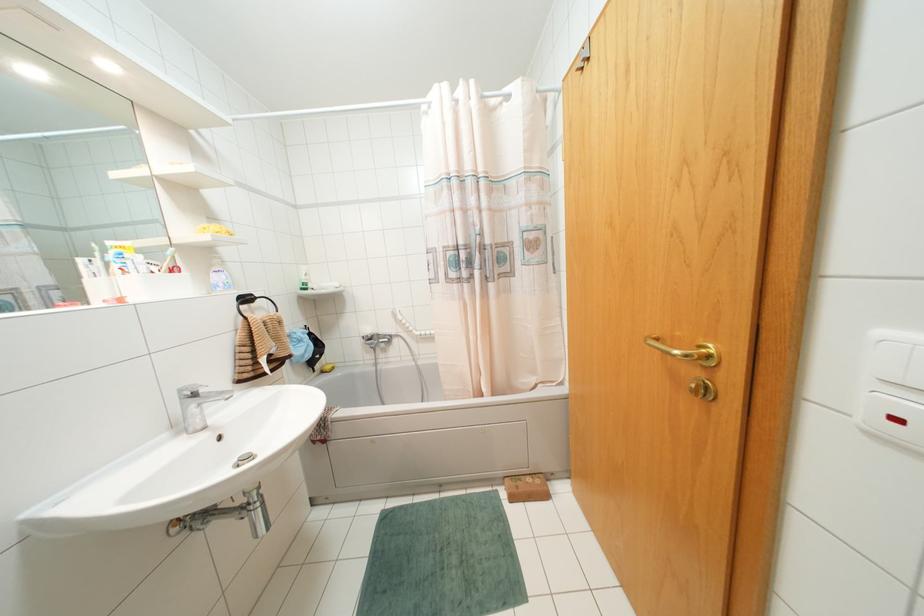
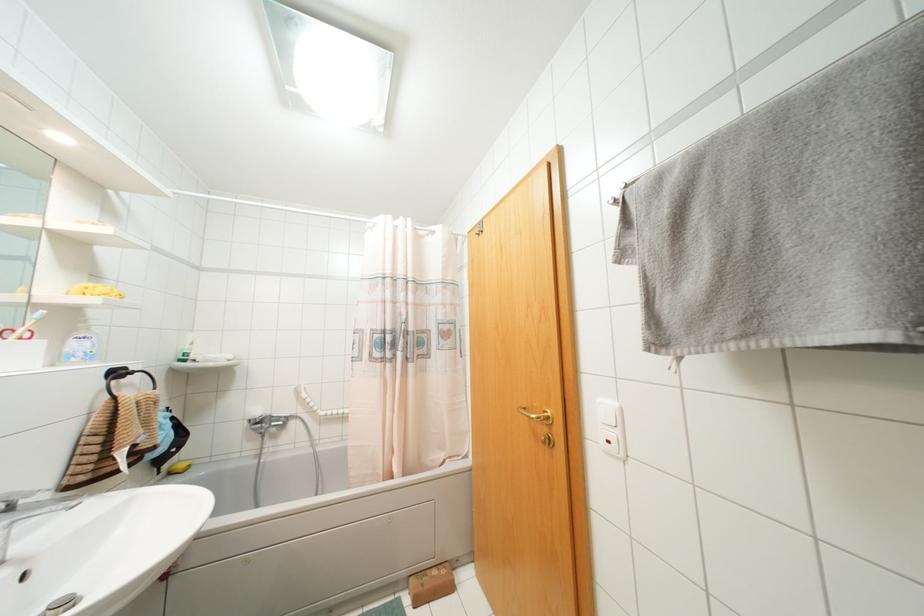
In the second image, find the point that corresponds to pixel 368 330 in the first image.

(258, 411)